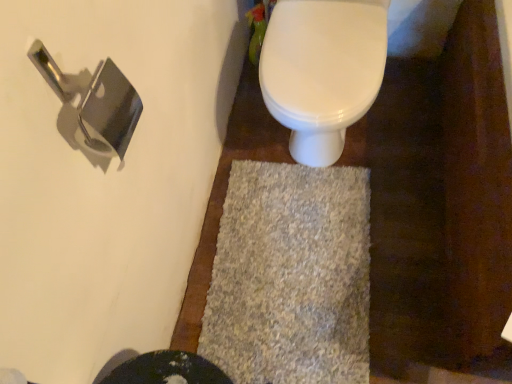
Question: Is white glossy toilet at upper center at the right side of gray shaggy bath mat at center?

Choices:
 (A) no
 (B) yes

Answer: (B)

Question: Is white glossy toilet at upper center behind gray shaggy bath mat at center?

Choices:
 (A) yes
 (B) no

Answer: (B)

Question: Is white glossy toilet at upper center touching gray shaggy bath mat at center?

Choices:
 (A) no
 (B) yes

Answer: (A)

Question: Is white glossy toilet at upper center closer to the viewer compared to gray shaggy bath mat at center?

Choices:
 (A) yes
 (B) no

Answer: (A)

Question: Can you confirm if white glossy toilet at upper center is taller than gray shaggy bath mat at center?

Choices:
 (A) yes
 (B) no

Answer: (A)

Question: In terms of width, does gray shaggy bath mat at center look wider or thinner when compared to polished silver door handle at upper left?

Choices:
 (A) thin
 (B) wide

Answer: (B)

Question: Do you think gray shaggy bath mat at center is within polished silver door handle at upper left, or outside of it?

Choices:
 (A) outside
 (B) inside

Answer: (A)

Question: From a real-world perspective, is gray shaggy bath mat at center physically located above or below polished silver door handle at upper left?

Choices:
 (A) below
 (B) above

Answer: (A)

Question: Relative to polished silver door handle at upper left, is gray shaggy bath mat at center in front or behind?

Choices:
 (A) front
 (B) behind

Answer: (B)

Question: Is white glossy toilet at upper center situated inside gray shaggy bath mat at center or outside?

Choices:
 (A) outside
 (B) inside

Answer: (A)

Question: In terms of width, does white glossy toilet at upper center look wider or thinner when compared to gray shaggy bath mat at center?

Choices:
 (A) thin
 (B) wide

Answer: (A)

Question: Is point (347, 84) positioned closer to the camera than point (295, 367)?

Choices:
 (A) closer
 (B) farther

Answer: (A)

Question: From a real-world perspective, is white glossy toilet at upper center above or below gray shaggy bath mat at center?

Choices:
 (A) below
 (B) above

Answer: (B)

Question: Is point (115, 82) positioned closer to the camera than point (266, 306)?

Choices:
 (A) closer
 (B) farther

Answer: (A)

Question: In terms of size, does polished silver door handle at upper left appear bigger or smaller than gray shaggy bath mat at center?

Choices:
 (A) big
 (B) small

Answer: (B)